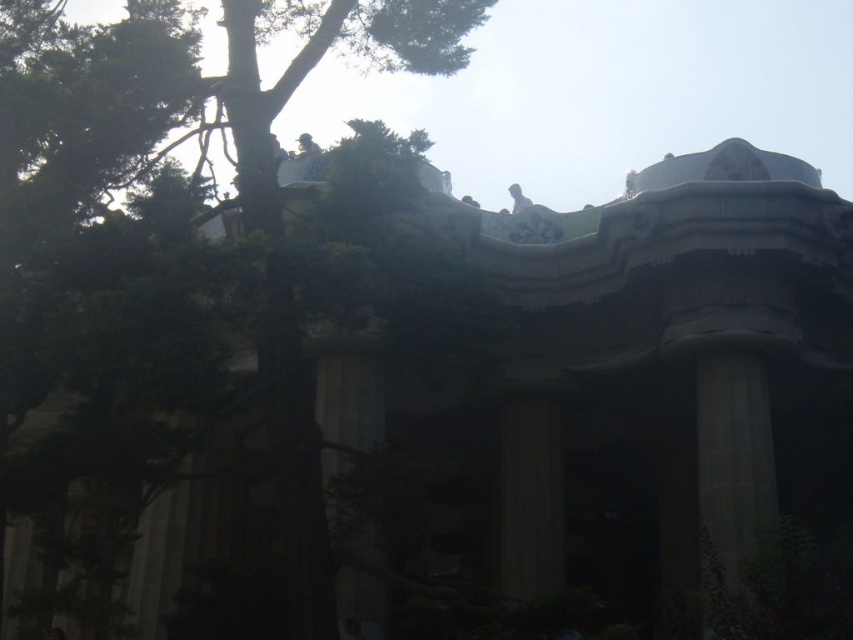
Looking at this image, is gray stone column at right to the right of light brown wooden statue at upper center from the viewer's perspective?

Correct, you'll find gray stone column at right to the right of light brown wooden statue at upper center.

Measure the distance between gray stone column at right and light brown wooden statue at upper center.

gray stone column at right and light brown wooden statue at upper center are 30.43 meters apart.

The width and height of the screenshot is (853, 640). What do you see at coordinates (733, 454) in the screenshot?
I see `gray stone column at right` at bounding box center [733, 454].

Locate an element on the screen. gray stone column at right is located at coordinates (733, 454).

Does green leafy tree at upper left have a lesser height compared to smooth stone column at center?

Incorrect, green leafy tree at upper left's height does not fall short of smooth stone column at center's.

Can you confirm if green leafy tree at upper left is bigger than smooth stone column at center?

Yes, green leafy tree at upper left is bigger than smooth stone column at center.

Does point (289, 296) lie in front of point (521, 416)?

Yes, point (289, 296) is in front of point (521, 416).

Locate an element on the screen. The height and width of the screenshot is (640, 853). green leafy tree at upper left is located at coordinates (283, 230).

Which of these two, green leafy tree at upper left or gray stone column at right, stands shorter?

With less height is gray stone column at right.

Is point (279, 257) closer to camera compared to point (753, 508)?

Yes.

At what (x,y) coordinates should I click in order to perform the action: click on green leafy tree at upper left. Please return your answer as a coordinate pair (x, y). This screenshot has width=853, height=640. Looking at the image, I should click on point(283,230).